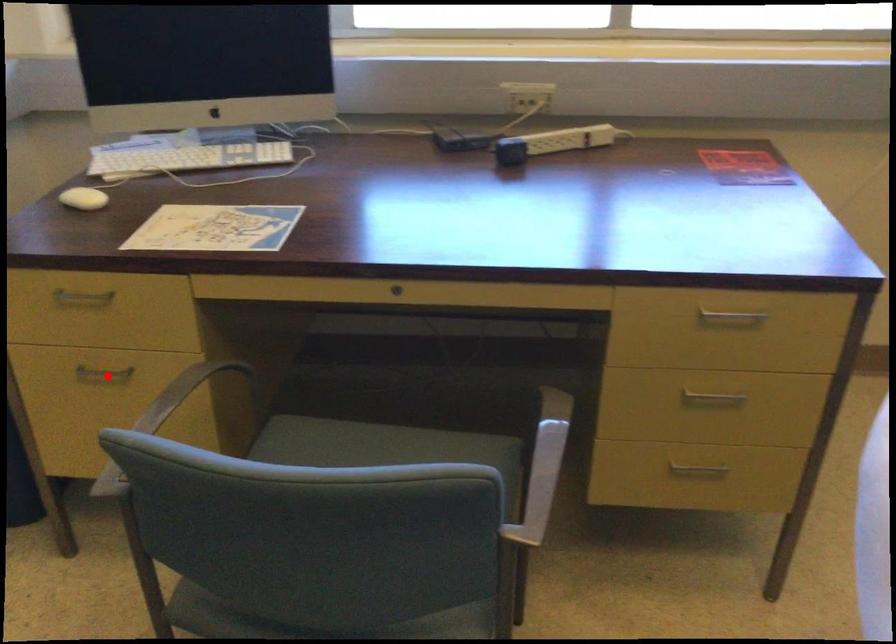
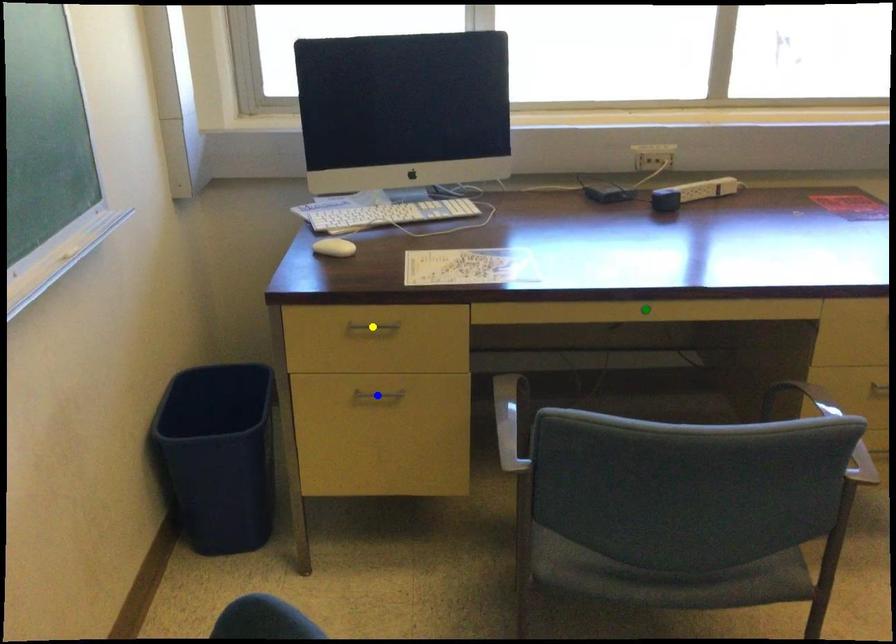
Question: I am providing you with two images of the same scene from different viewpoints. A red point is marked on the first image. You are given multiple points on the second image. Can you choose the point in image 2 that corresponds to the point in image 1?

Choices:
 (A) green point
 (B) blue point
 (C) yellow point

Answer: (B)